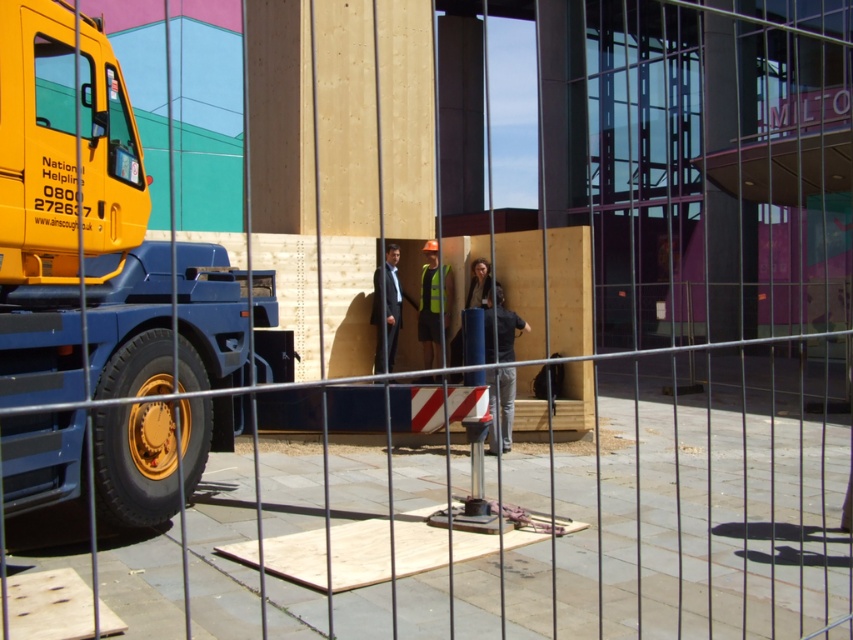
Between point (68, 42) and point (375, 358), which one is positioned in front?

Positioned in front is point (68, 42).

Identify the location of yellow metallic trailer truck at left. [93, 234].

Which is in front, point (96, 113) or point (372, 298)?

Point (96, 113) is more forward.

The height and width of the screenshot is (640, 853). Find the location of `yellow metallic trailer truck at left`. yellow metallic trailer truck at left is located at coordinates (93, 234).